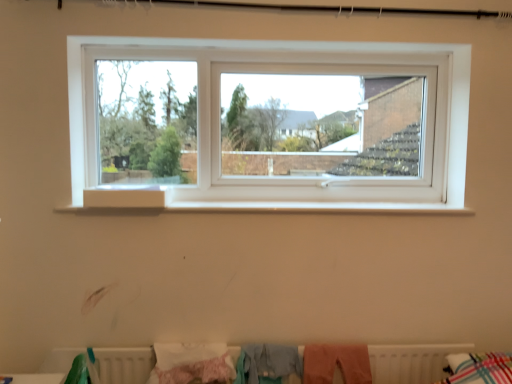
Question: Which direction should I rotate to look at pink fluffy blanket at lower center, placed as the third clothing when sorted from right to left, — up or down?

Choices:
 (A) up
 (B) down

Answer: (B)

Question: From a real-world perspective, is white matte radiator at lower center on top of pink fabric at lower center, which is the 3th clothing from left to right?

Choices:
 (A) yes
 (B) no

Answer: (B)

Question: Does white matte radiator at lower center lie in front of pink fabric at lower center, which is counted as the 1th clothing, starting from the right?

Choices:
 (A) yes
 (B) no

Answer: (A)

Question: Would you say white matte radiator at lower center is outside pink fabric at lower center, which is counted as the 1th clothing, starting from the right?

Choices:
 (A) no
 (B) yes

Answer: (B)

Question: Considering the relative sizes of white matte radiator at lower center and pink fabric at lower center, which is the 3th clothing from left to right, in the image provided, is white matte radiator at lower center wider than pink fabric at lower center, which is the 3th clothing from left to right,?

Choices:
 (A) no
 (B) yes

Answer: (A)

Question: Does white matte radiator at lower center have a larger size compared to pink fabric at lower center, which is counted as the 1th clothing, starting from the right?

Choices:
 (A) yes
 (B) no

Answer: (A)

Question: From a real-world perspective, is white matte radiator at lower center positioned under pink fabric at lower center, which is the 3th clothing from left to right, based on gravity?

Choices:
 (A) no
 (B) yes

Answer: (B)

Question: Is light blue fabric at lower center, placed as the 2th clothing when sorted from left to right, surrounded by pink fabric at lower center, which is counted as the 1th clothing, starting from the right?

Choices:
 (A) yes
 (B) no

Answer: (B)

Question: Are pink fabric at lower center, which is the 3th clothing from left to right, and light blue fabric at lower center, acting as the second clothing starting from the right, beside each other?

Choices:
 (A) yes
 (B) no

Answer: (B)

Question: Is pink fabric at lower center, which is counted as the 1th clothing, starting from the right, turned away from light blue fabric at lower center, placed as the 2th clothing when sorted from left to right?

Choices:
 (A) no
 (B) yes

Answer: (A)

Question: Can you confirm if pink fabric at lower center, which is the 3th clothing from left to right, is taller than light blue fabric at lower center, acting as the second clothing starting from the right?

Choices:
 (A) no
 (B) yes

Answer: (A)

Question: From the image's perspective, does pink fabric at lower center, which is counted as the 1th clothing, starting from the right, appear higher than light blue fabric at lower center, placed as the 2th clothing when sorted from left to right?

Choices:
 (A) yes
 (B) no

Answer: (B)

Question: Considering the relative sizes of pink fabric at lower center, which is the 3th clothing from left to right, and light blue fabric at lower center, acting as the second clothing starting from the right, in the image provided, is pink fabric at lower center, which is the 3th clothing from left to right, shorter than light blue fabric at lower center, acting as the second clothing starting from the right,?

Choices:
 (A) yes
 (B) no

Answer: (A)

Question: Is pink fabric at lower center, which is the 3th clothing from left to right, bigger than pink fluffy blanket at lower center, placed as the third clothing when sorted from right to left?

Choices:
 (A) yes
 (B) no

Answer: (B)